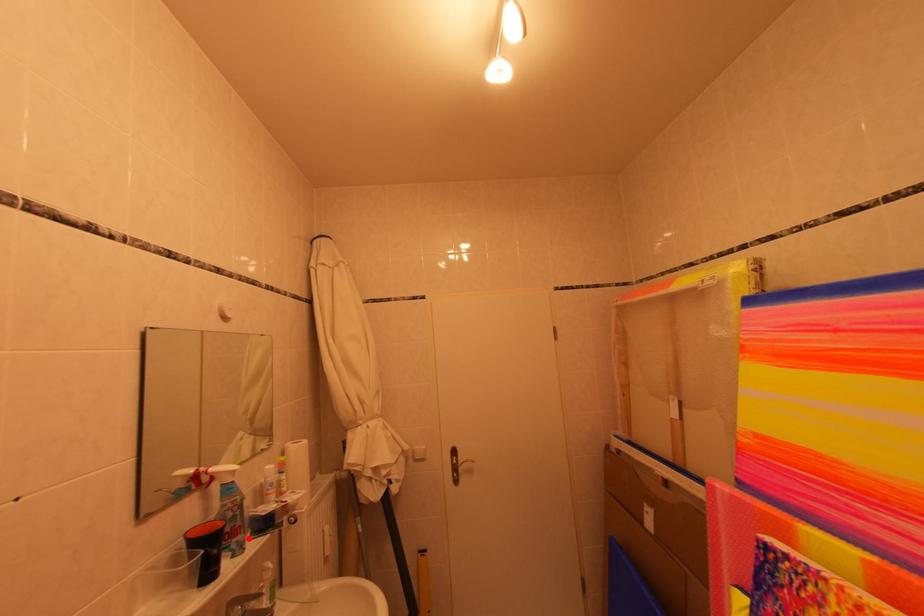
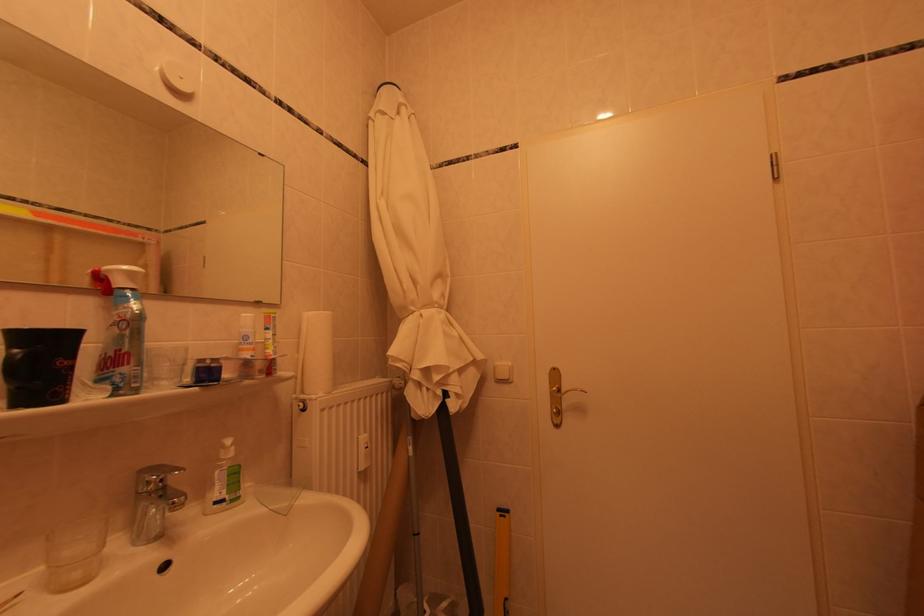
Question: I am providing you with two images of the same scene from different viewpoints. A red point is marked on the first image. At the location where the point appears in image 1, is it still visible in image 2?

Choices:
 (A) Yes
 (B) No

Answer: (A)